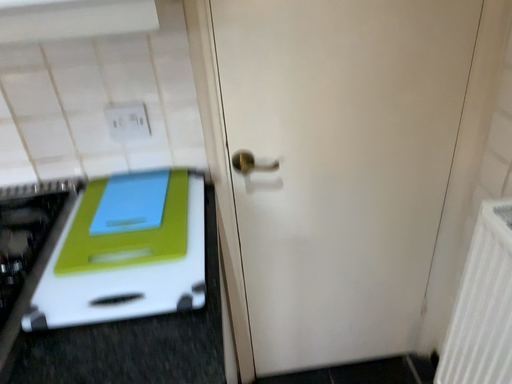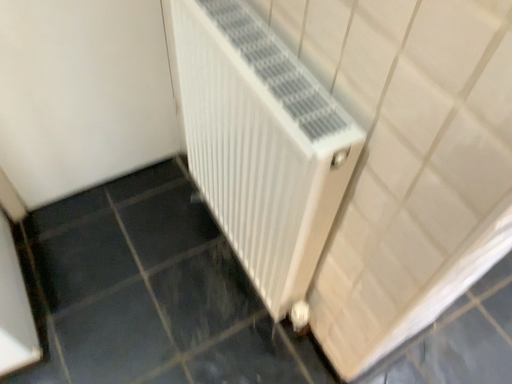
Question: How did the camera likely rotate when shooting the video?

Choices:
 (A) rotated left
 (B) rotated right

Answer: (B)